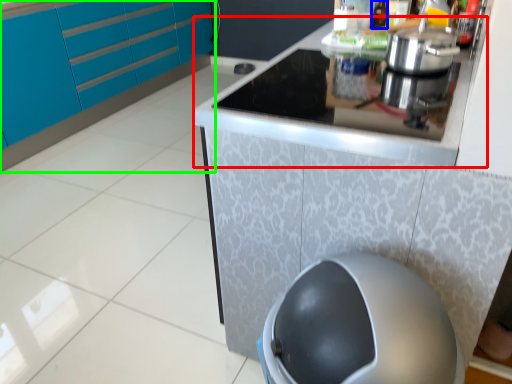
Question: Considering the real-world distances, which object is closest to counter top (highlighted by a red box)? bottle (highlighted by a blue box) or cabinetry (highlighted by a green box).

Choices:
 (A) bottle
 (B) cabinetry

Answer: (A)